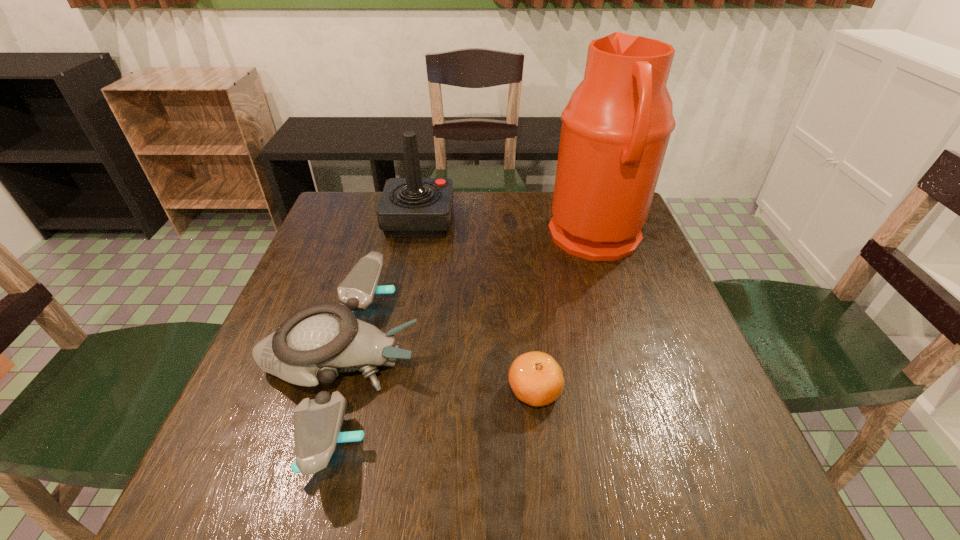
You are a GUI agent. You are given a task and a screenshot of the screen. Output one action in this format:
    pyautogui.click(x=<x>, y=<y>)
    Task: Click on the vacant point located on the front-facing side of the second shortest object
    This screenshot has height=540, width=960.
    Given the screenshot: What is the action you would take?
    pyautogui.click(x=591, y=363)

You are a GUI agent. You are given a task and a screenshot of the screen. Output one action in this format:
    pyautogui.click(x=<x>, y=<y>)
    Task: Click on the vacant position located on the back of the shortest object
    
    Given the screenshot: What is the action you would take?
    pyautogui.click(x=519, y=255)

The image size is (960, 540). I want to click on water jug present at the far edge, so [616, 127].

The image size is (960, 540). In order to click on joystick at the far edge in this screenshot , I will do [x=413, y=206].

Locate an element on the screen. object that is positioned at the near edge is located at coordinates (316, 343).

You are a GUI agent. You are given a task and a screenshot of the screen. Output one action in this format:
    pyautogui.click(x=<x>, y=<y>)
    Task: Click on the object that is at the left edge
    This screenshot has height=540, width=960.
    Given the screenshot: What is the action you would take?
    pyautogui.click(x=316, y=343)

Locate an element on the screen. The width and height of the screenshot is (960, 540). object that is at the right edge is located at coordinates (616, 127).

At what (x,y) coordinates should I click in order to perform the action: click on object present at the near left corner. Please return your answer as a coordinate pair (x, y). The image size is (960, 540). Looking at the image, I should click on (316, 343).

The height and width of the screenshot is (540, 960). I want to click on object located in the far right corner section of the desktop, so click(616, 127).

Identify the location of vacant space at the far edge of the desktop. (488, 192).